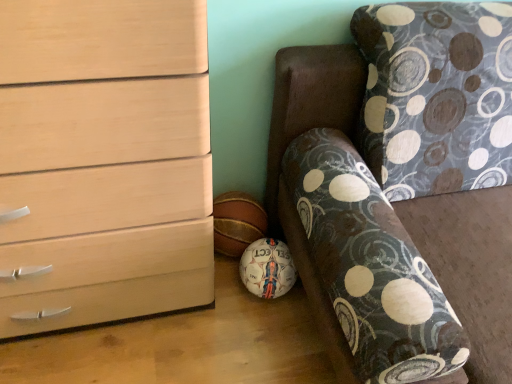
Identify the location of patterned fabric couch at lower right. This screenshot has width=512, height=384. (386, 178).

Image resolution: width=512 pixels, height=384 pixels. What do you see at coordinates (386, 178) in the screenshot?
I see `patterned fabric couch at lower right` at bounding box center [386, 178].

From the picture: Measure the distance between point (284, 85) and camera.

1.17 meters.

What do you see at coordinates (103, 162) in the screenshot?
I see `matte wood chest of drawers at left` at bounding box center [103, 162].

You are a GUI agent. You are given a task and a screenshot of the screen. Output one action in this format:
    pyautogui.click(x=<x>, y=<y>)
    Task: Click on the matte wood chest of drawers at left
    
    Given the screenshot: What is the action you would take?
    pyautogui.click(x=103, y=162)

Locate an element on the screen. patterned fabric couch at lower right is located at coordinates tap(386, 178).

Which object is positioned more to the right, matte wood chest of drawers at left or patterned fabric couch at lower right?

Positioned to the right is patterned fabric couch at lower right.

Which is in front, matte wood chest of drawers at left or patterned fabric couch at lower right?

patterned fabric couch at lower right is closer to the camera.

Which point is more forward, (44, 263) or (446, 155)?

The point (44, 263) is closer.

From the image's perspective, which one is positioned lower, matte wood chest of drawers at left or patterned fabric couch at lower right?

From the image's view, patterned fabric couch at lower right is below.

From the picture: From a real-world perspective, is matte wood chest of drawers at left above or below patterned fabric couch at lower right?

matte wood chest of drawers at left is situated higher than patterned fabric couch at lower right in the real world.

Can you confirm if matte wood chest of drawers at left is thinner than patterned fabric couch at lower right?

Correct, the width of matte wood chest of drawers at left is less than that of patterned fabric couch at lower right.

Between matte wood chest of drawers at left and patterned fabric couch at lower right, which one has less height?

Answer: patterned fabric couch at lower right is shorter.

Considering the relative sizes of matte wood chest of drawers at left and patterned fabric couch at lower right in the image provided, is matte wood chest of drawers at left bigger than patterned fabric couch at lower right?

Actually, matte wood chest of drawers at left might be smaller than patterned fabric couch at lower right.

Which is correct: matte wood chest of drawers at left is inside patterned fabric couch at lower right, or outside of it?

matte wood chest of drawers at left cannot be found inside patterned fabric couch at lower right.

Is matte wood chest of drawers at left far away from patterned fabric couch at lower right?

No, there isn't a large distance between matte wood chest of drawers at left and patterned fabric couch at lower right.

Is matte wood chest of drawers at left positioned with its back to patterned fabric couch at lower right?

No, patterned fabric couch at lower right is not at the back of matte wood chest of drawers at left.

This screenshot has width=512, height=384. Find the location of `furniture located below the matte wood chest of drawers at left (from the image's perspective)`. furniture located below the matte wood chest of drawers at left (from the image's perspective) is located at coordinates (386, 178).

Consider the image. Considering the relative positions of patterned fabric couch at lower right and matte wood chest of drawers at left in the image provided, is patterned fabric couch at lower right to the right of matte wood chest of drawers at left from the viewer's perspective?

Yes.

Which is in front, patterned fabric couch at lower right or matte wood chest of drawers at left?

patterned fabric couch at lower right.

Which is behind, point (506, 48) or point (37, 71)?

The point (506, 48) is behind.

From the image's perspective, who appears lower, patterned fabric couch at lower right or matte wood chest of drawers at left?

patterned fabric couch at lower right is shown below in the image.

From a real-world perspective, is patterned fabric couch at lower right under matte wood chest of drawers at left?

Yes, from a real-world perspective, patterned fabric couch at lower right is below matte wood chest of drawers at left.

Considering the sizes of objects patterned fabric couch at lower right and matte wood chest of drawers at left in the image provided, who is thinner, patterned fabric couch at lower right or matte wood chest of drawers at left?

matte wood chest of drawers at left is thinner.

Who is shorter, patterned fabric couch at lower right or matte wood chest of drawers at left?

patterned fabric couch at lower right.

Can you confirm if patterned fabric couch at lower right is smaller than matte wood chest of drawers at left?

Incorrect, patterned fabric couch at lower right is not smaller in size than matte wood chest of drawers at left.

Would you say patterned fabric couch at lower right is outside matte wood chest of drawers at left?

patterned fabric couch at lower right is positioned outside matte wood chest of drawers at left.

Is there a large distance between patterned fabric couch at lower right and matte wood chest of drawers at left?

No, there isn't a large distance between patterned fabric couch at lower right and matte wood chest of drawers at left.

Is patterned fabric couch at lower right looking in the opposite direction of matte wood chest of drawers at left?

That's not correct — patterned fabric couch at lower right is not looking away from matte wood chest of drawers at left.

How different are the orientations of patterned fabric couch at lower right and matte wood chest of drawers at left in degrees?

The angle between the facing direction of patterned fabric couch at lower right and the facing direction of matte wood chest of drawers at left is 0.505 degrees.

Find the location of `furniture in front of the matte wood chest of drawers at left`. furniture in front of the matte wood chest of drawers at left is located at coordinates (386, 178).

Image resolution: width=512 pixels, height=384 pixels. I want to click on furniture that is on the right side of matte wood chest of drawers at left, so click(x=386, y=178).

This screenshot has height=384, width=512. In order to click on furniture that is below the matte wood chest of drawers at left (from the image's perspective) in this screenshot , I will do `click(386, 178)`.